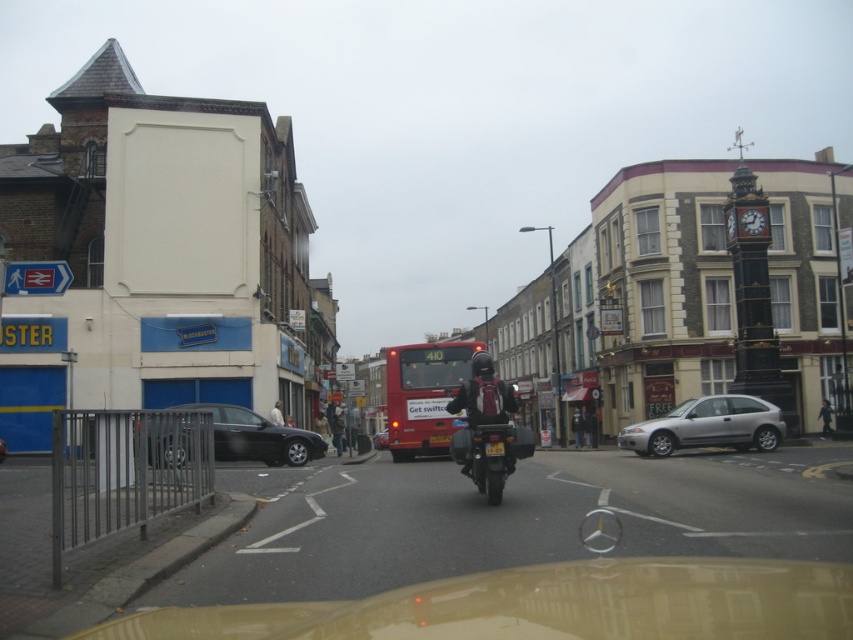
Question: Which of these objects is positioned farthest from the shiny black motorcycle at center?

Choices:
 (A) gold metallic car at lower center
 (B) shiny red bus at center
 (C) shiny black sedan at left

Answer: (B)

Question: Which point is closer to the camera taking this photo?

Choices:
 (A) (703, 410)
 (B) (656, 600)
 (C) (276, 403)
 (D) (373, 444)

Answer: (B)

Question: Which point appears farthest from the camera in this image?

Choices:
 (A) (379, 432)
 (B) (274, 416)
 (C) (131, 621)
 (D) (397, 401)

Answer: (A)

Question: Does red matte bus at center appear on the left side of shiny black sedan at left?

Choices:
 (A) no
 (B) yes

Answer: (A)

Question: Does silver metallic hatchback at center-right come in front of shiny red bus at center?

Choices:
 (A) yes
 (B) no

Answer: (A)

Question: Does red matte bus at center have a smaller size compared to silver metallic hatchback at center-right?

Choices:
 (A) no
 (B) yes

Answer: (A)